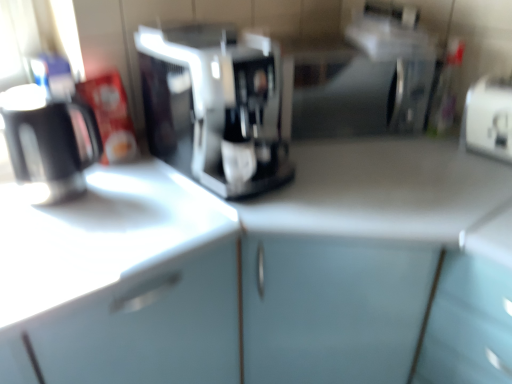
This screenshot has width=512, height=384. Identify the location of vacant point to the right of matte black mug at left. (135, 188).